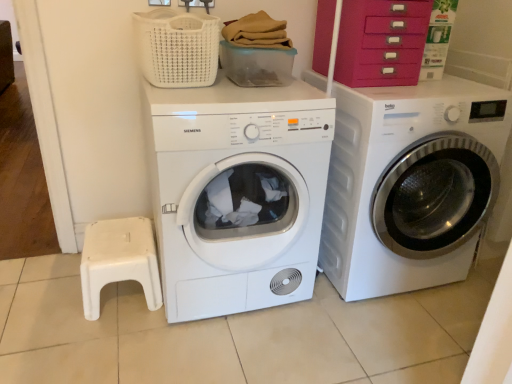
Question: From a real-world perspective, relative to white matte dryer at center, positioned as the second washing machine in right-to-left order, is white glossy washing machine at right, which appears as the 1th washing machine when viewed from the right, vertically above or below?

Choices:
 (A) below
 (B) above

Answer: (B)

Question: Is white glossy washing machine at right, placed as the 2th washing machine when sorted from left to right, bigger or smaller than white matte dryer at center, marked as the first washing machine in a left-to-right arrangement?

Choices:
 (A) big
 (B) small

Answer: (A)

Question: Which object is positioned farthest from the white plastic step stool at lower left?

Choices:
 (A) velvet pink drawer at upper right
 (B) white glossy washing machine at right, which appears as the 1th washing machine when viewed from the right
 (C) white woven basket at upper center
 (D) white matte dryer at center, marked as the first washing machine in a left-to-right arrangement

Answer: (A)

Question: Which of these objects is positioned farthest from the white matte dryer at center, positioned as the second washing machine in right-to-left order?

Choices:
 (A) white glossy washing machine at right, placed as the 2th washing machine when sorted from left to right
 (B) white plastic step stool at lower left
 (C) white woven basket at upper center
 (D) velvet pink drawer at upper right

Answer: (D)